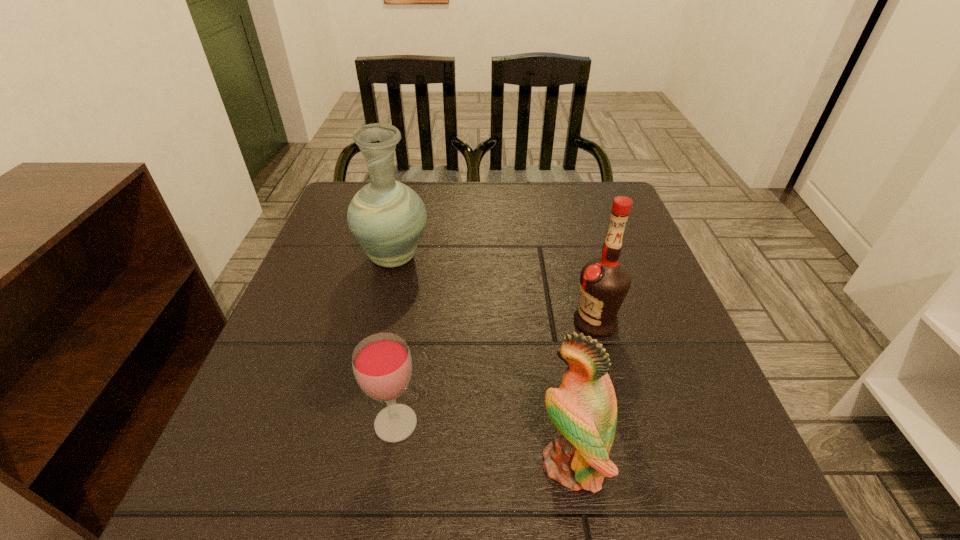
Identify the location of the farthest object. The width and height of the screenshot is (960, 540). (387, 218).

This screenshot has width=960, height=540. I want to click on the third nearest object, so click(604, 282).

The image size is (960, 540). I want to click on parrot, so click(x=584, y=409).

The height and width of the screenshot is (540, 960). I want to click on the shortest object, so click(382, 364).

Locate an element on the screen. The height and width of the screenshot is (540, 960). vacant space located on the handle side of the farthest object is located at coordinates (405, 212).

Find the location of a particular element. vacant space situated on the handle side of the farthest object is located at coordinates (409, 195).

Image resolution: width=960 pixels, height=540 pixels. I want to click on vacant area situated 0.210m on the handle side of the farthest object, so [x=409, y=193].

I want to click on free space located 0.390m on the front and back of the third nearest object, so click(x=376, y=322).

I want to click on vacant space located on the front and back of the third nearest object, so click(x=471, y=322).

I want to click on vacant space located on the front and back of the third nearest object, so click(537, 322).